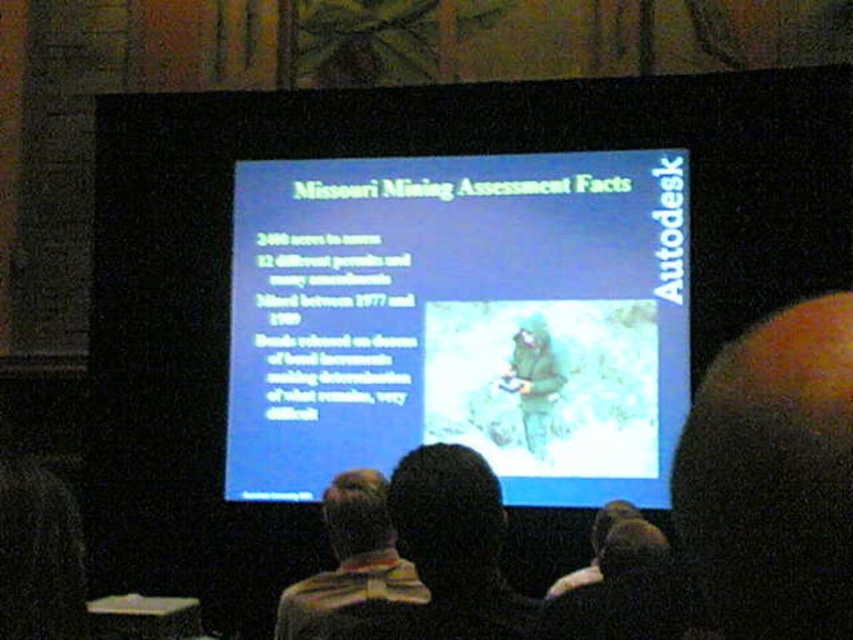
Question: Is blue matte screen at center further to the viewer compared to dark brown hair at upper right?

Choices:
 (A) no
 (B) yes

Answer: (A)

Question: Which object appears closest to the camera in this image?

Choices:
 (A) striped shirt at center
 (B) dark brown hair at upper right
 (C) blue matte screen at center

Answer: (A)

Question: Is blue matte screen at center wider than striped shirt at center?

Choices:
 (A) no
 (B) yes

Answer: (B)

Question: Is dark brown hair at upper right below striped shirt at center?

Choices:
 (A) yes
 (B) no

Answer: (B)

Question: Which point is farther to the camera?

Choices:
 (A) (381, 228)
 (B) (344, 525)

Answer: (A)

Question: Based on their relative distances, which object is nearer to the dark brown hair at upper right?

Choices:
 (A) blue matte screen at center
 (B) striped shirt at center

Answer: (A)